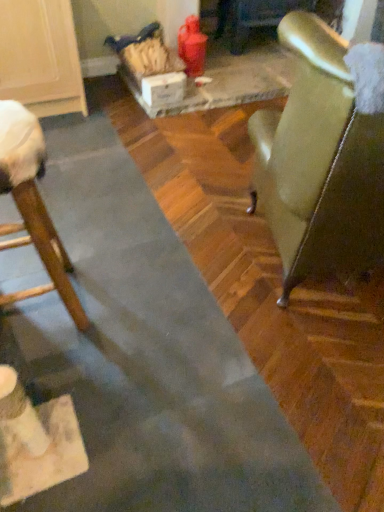
Question: Is wooden chair at left, arranged as the second chair when viewed from the right, facing towards white cardboard box at center?

Choices:
 (A) no
 (B) yes

Answer: (A)

Question: Is wooden chair at left, which ranks as the first chair in left-to-right order, turned away from white cardboard box at center?

Choices:
 (A) no
 (B) yes

Answer: (A)

Question: From the image's perspective, is wooden chair at left, arranged as the second chair when viewed from the right, located above white cardboard box at center?

Choices:
 (A) yes
 (B) no

Answer: (B)

Question: Is wooden chair at left, arranged as the second chair when viewed from the right, positioned beyond the bounds of white cardboard box at center?

Choices:
 (A) yes
 (B) no

Answer: (A)

Question: Considering the relative positions of wooden chair at left, which ranks as the first chair in left-to-right order, and white cardboard box at center in the image provided, is wooden chair at left, which ranks as the first chair in left-to-right order, behind white cardboard box at center?

Choices:
 (A) yes
 (B) no

Answer: (B)

Question: From a real-world perspective, relative to leather-like green chair at right, arranged as the 2th chair when viewed from the left, is white cardboard box at center vertically above or below?

Choices:
 (A) above
 (B) below

Answer: (B)

Question: Is white cardboard box at center in front of or behind leather-like green chair at right, the first chair when ordered from right to left, in the image?

Choices:
 (A) front
 (B) behind

Answer: (B)

Question: Visually, is white cardboard box at center positioned to the left or to the right of leather-like green chair at right, arranged as the 2th chair when viewed from the left?

Choices:
 (A) left
 (B) right

Answer: (A)

Question: Considering the positions of white cardboard box at center and leather-like green chair at right, arranged as the 2th chair when viewed from the left, in the image, is white cardboard box at center taller or shorter than leather-like green chair at right, arranged as the 2th chair when viewed from the left,?

Choices:
 (A) tall
 (B) short

Answer: (B)

Question: From a real-world perspective, is wooden chair at left, which ranks as the first chair in left-to-right order, above or below white cardboard box at center?

Choices:
 (A) below
 (B) above

Answer: (B)

Question: From the image's perspective, is wooden chair at left, arranged as the second chair when viewed from the right, positioned above or below white cardboard box at center?

Choices:
 (A) below
 (B) above

Answer: (A)

Question: Considering the positions of wooden chair at left, which ranks as the first chair in left-to-right order, and white cardboard box at center in the image, is wooden chair at left, which ranks as the first chair in left-to-right order, taller or shorter than white cardboard box at center?

Choices:
 (A) short
 (B) tall

Answer: (B)

Question: Considering the positions of wooden chair at left, which ranks as the first chair in left-to-right order, and white cardboard box at center in the image, is wooden chair at left, which ranks as the first chair in left-to-right order, wider or thinner than white cardboard box at center?

Choices:
 (A) thin
 (B) wide

Answer: (B)

Question: Considering the positions of wooden chair at left, which ranks as the first chair in left-to-right order, and leather-like green chair at right, the first chair when ordered from right to left, in the image, is wooden chair at left, which ranks as the first chair in left-to-right order, taller or shorter than leather-like green chair at right, the first chair when ordered from right to left,?

Choices:
 (A) tall
 (B) short

Answer: (B)

Question: Does point (29, 217) appear closer or farther from the camera than point (286, 36)?

Choices:
 (A) closer
 (B) farther

Answer: (B)